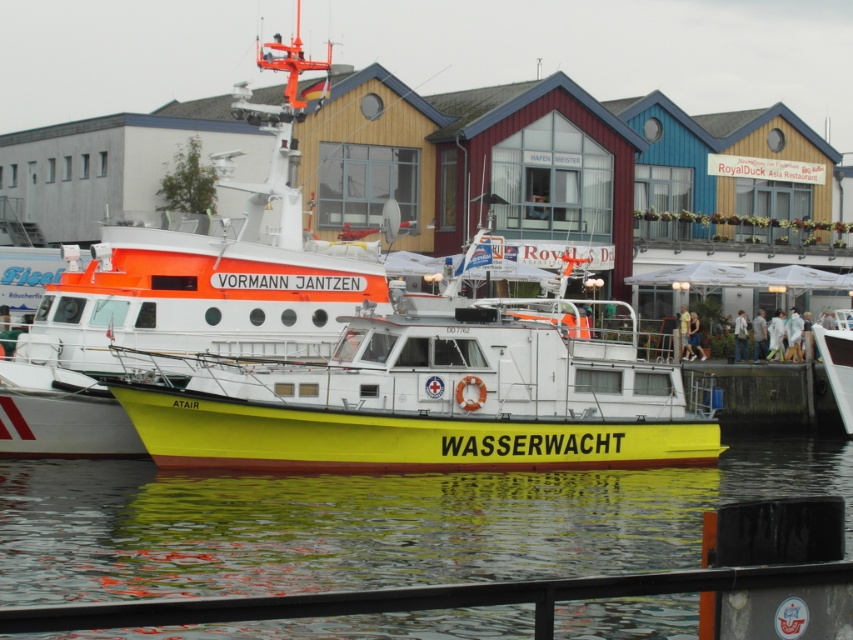
Consider the image. You are a lifeguard on the rescue boat and see two people in the water. One is a white fabric person at lower right and the other is a yellow fabric person at right. Which person is closer to the rescue boat?

The white fabric person at lower right is closer to the rescue boat because they are positioned below the yellow fabric person at right, meaning they are in a lower position relative to the boat.

You are standing at the point with coordinates (438, 396) in the image. Which boat are you standing on?

You are standing on the yellow matte boat at center.

Based on the photo, you are standing on the dock and see two people in the water near the boats. The white fabric person at lower right and the yellow fabric person at right. Which person is closer to the rescue boat labeled WASSERWACHT?

The yellow fabric person at right is closer to the rescue boat labeled WASSERWACHT because the white fabric person at lower right is to the right of the yellow fabric person at right, meaning the yellow fabric person is positioned between the rescue boat and the white fabric person.